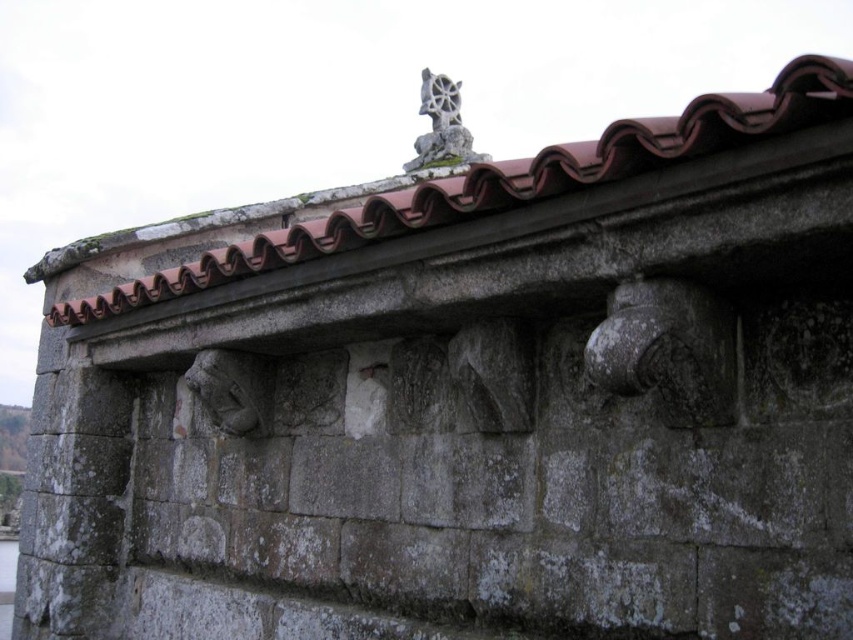
Question: Which of the following is the closest to the observer?

Choices:
 (A) (444, 132)
 (B) (424, 198)

Answer: (B)

Question: Which of the following is the farthest from the observer?

Choices:
 (A) brown clay tiles at upper center
 (B) gray stone sculpture at upper center

Answer: (B)

Question: Among these points, which one is farthest from the camera?

Choices:
 (A) (538, 161)
 (B) (425, 80)

Answer: (B)

Question: Is the position of brown clay tiles at upper center less distant than that of gray stone sculpture at upper center?

Choices:
 (A) yes
 (B) no

Answer: (A)

Question: Can you confirm if brown clay tiles at upper center is positioned above gray stone sculpture at upper center?

Choices:
 (A) yes
 (B) no

Answer: (B)

Question: Is brown clay tiles at upper center bigger than gray stone sculpture at upper center?

Choices:
 (A) no
 (B) yes

Answer: (A)